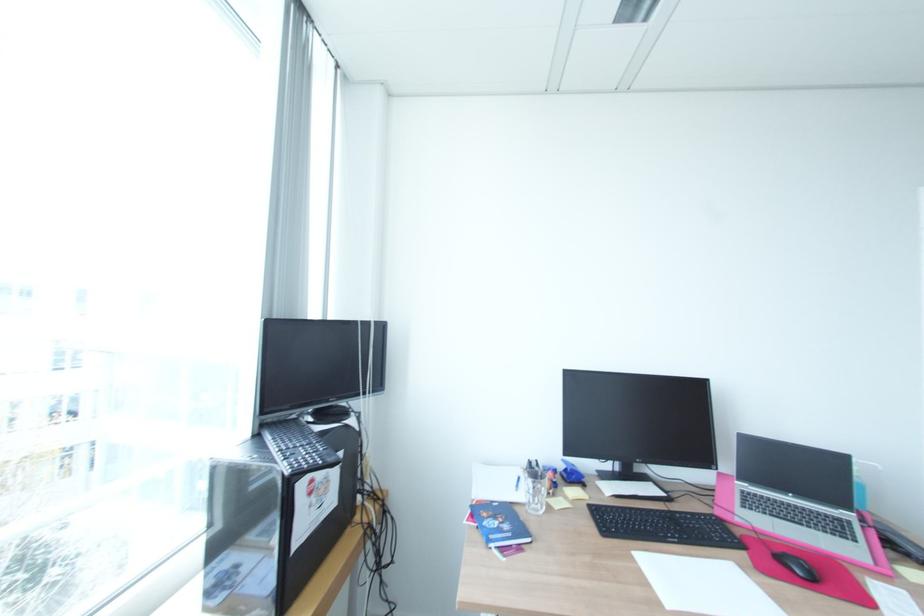
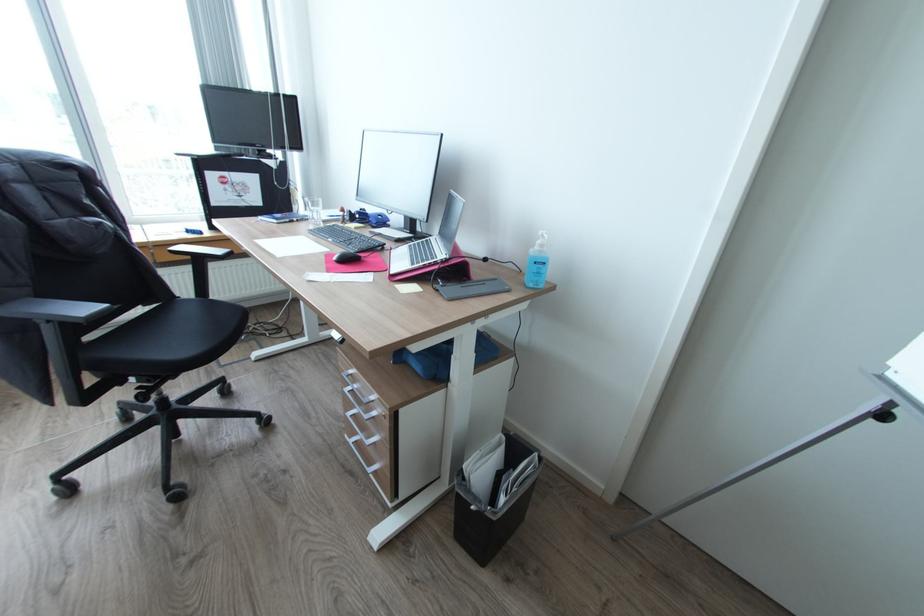
The point at (748,492) is marked in the first image. Where is the corresponding point in the second image?

(432, 238)